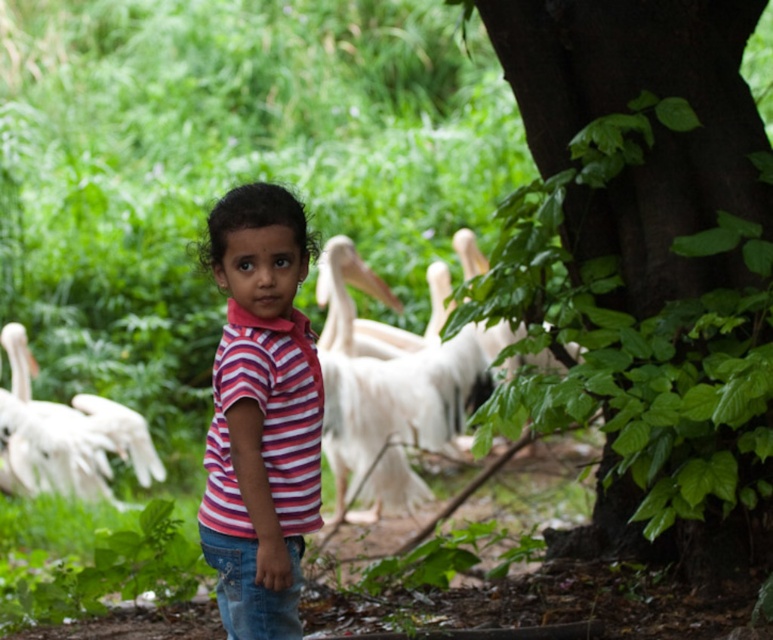
Question: Which object appears farthest from the camera in this image?

Choices:
 (A) green leafy tree at center right
 (B) white feathered pelican at center

Answer: (B)

Question: Does pink striped shirt at center have a smaller size compared to white feathered pelican at center?

Choices:
 (A) yes
 (B) no

Answer: (A)

Question: Which object is farther from the camera taking this photo?

Choices:
 (A) denim at center
 (B) white feathered pelican at lower left
 (C) white feathered pelican at center
 (D) pink striped shirt at center

Answer: (B)

Question: Estimate the real-world distances between objects in this image. Which object is farther from the white feathered pelican at center?

Choices:
 (A) green leafy tree at center right
 (B) white feathered pelican at lower left
 (C) pink striped shirt at center
 (D) denim at center

Answer: (C)

Question: Where is white feathered pelican at lower left located in relation to denim at center in the image?

Choices:
 (A) right
 (B) left

Answer: (B)

Question: Does green leafy tree at center right have a lesser width compared to pink striped shirt at center?

Choices:
 (A) yes
 (B) no

Answer: (B)